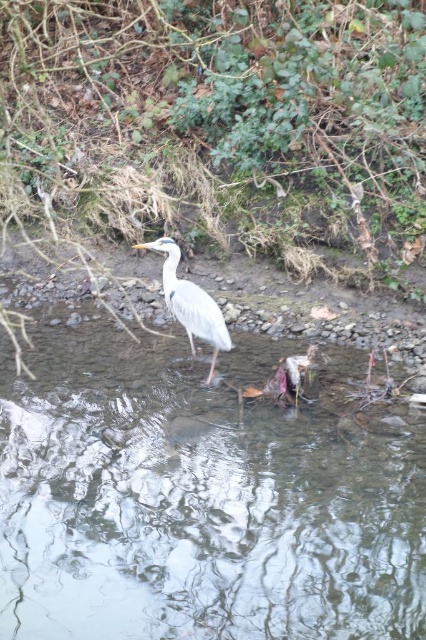
This screenshot has height=640, width=426. What do you see at coordinates (196, 502) in the screenshot?
I see `clear water at center` at bounding box center [196, 502].

Does clear water at center have a greater width compared to gray feathered heron at center?

Yes.

At what (x,y) coordinates should I click in order to perform the action: click on clear water at center. Please return your answer as a coordinate pair (x, y). Looking at the image, I should click on (196, 502).